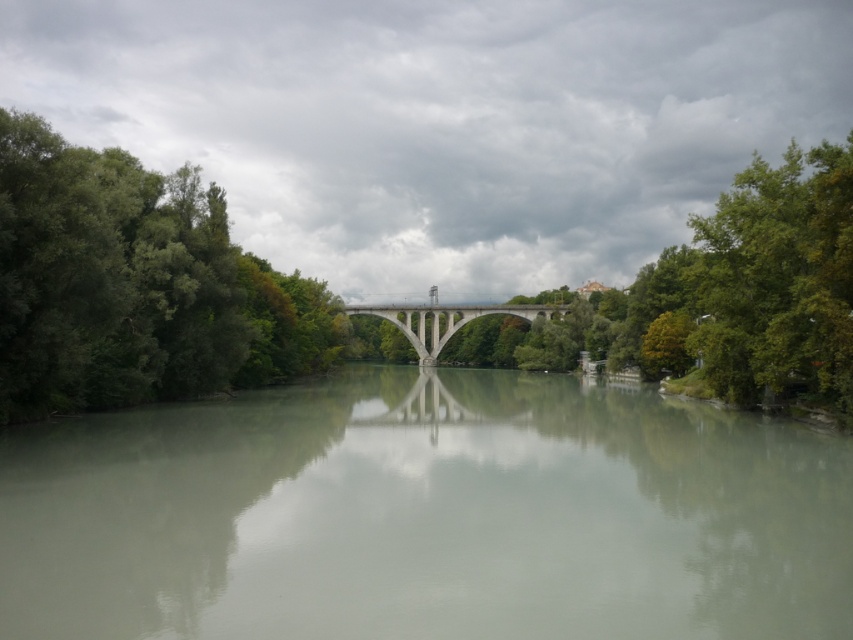
Between green leafy trees at left and concrete bridge at center, which one appears on the left side from the viewer's perspective?

From the viewer's perspective, green leafy trees at left appears more on the left side.

Between point (183, 244) and point (460, 336), which one is positioned in front?

Point (183, 244) is in front.

Locate an element on the screen. This screenshot has width=853, height=640. green leafy trees at left is located at coordinates (135, 285).

Is clear water at center below green leafy tree at center?

Indeed, clear water at center is positioned under green leafy tree at center.

Does clear water at center have a larger size compared to green leafy tree at center?

No, clear water at center is not bigger than green leafy tree at center.

At what (x,y) coordinates should I click in order to perform the action: click on clear water at center. Please return your answer as a coordinate pair (x, y). The height and width of the screenshot is (640, 853). Looking at the image, I should click on (426, 515).

Locate an element on the screen. clear water at center is located at coordinates (426, 515).

Can you confirm if clear water at center is smaller than concrete bridge at center?

Indeed, clear water at center has a smaller size compared to concrete bridge at center.

In the scene shown: Who is more distant from viewer, (415, 486) or (550, 316)?

The point (550, 316) is more distant.

Which is in front, point (10, 582) or point (457, 307)?

Point (10, 582) is in front.

Locate an element on the screen. clear water at center is located at coordinates (426, 515).